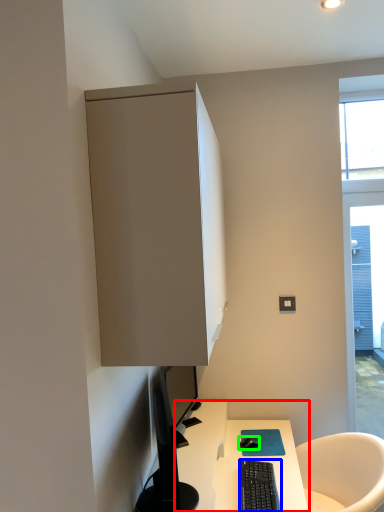
Question: Which is nearer to the desk (highlighted by a red box)? computer keyboard (highlighted by a blue box) or mouse (highlighted by a green box).

Choices:
 (A) computer keyboard
 (B) mouse

Answer: (A)